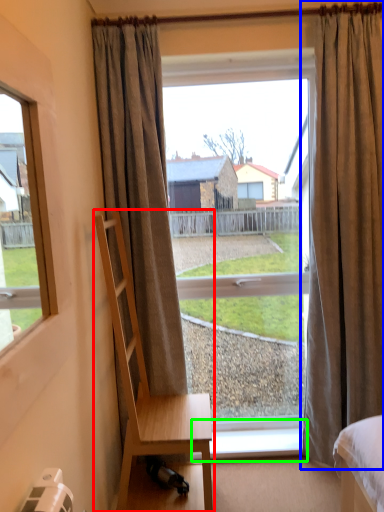
Question: Estimate the real-world distances between objects in this image. Which object is farther from chair (highlighted by a red box), curtain (highlighted by a blue box) or window sill (highlighted by a green box)?

Choices:
 (A) curtain
 (B) window sill

Answer: (A)